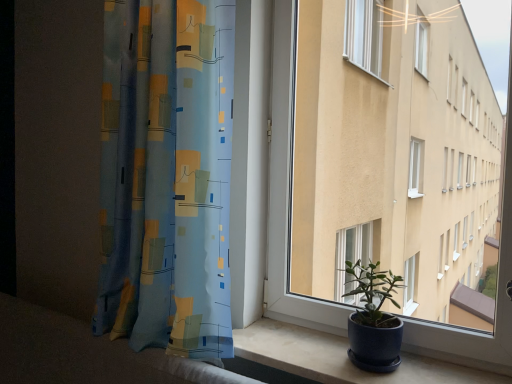
The image size is (512, 384). I want to click on free space to the left of matte blue pot at lower right, so 308,361.